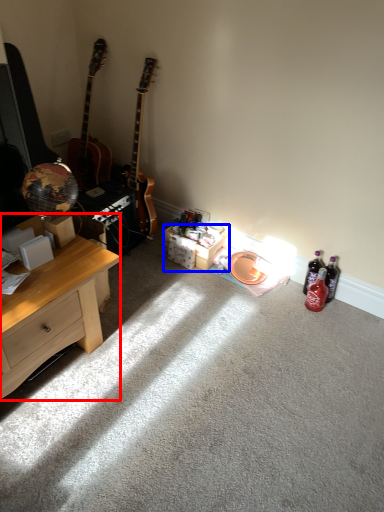
Question: Among these objects, which one is farthest to the camera, desk (highlighted by a red box) or box (highlighted by a blue box)?

Choices:
 (A) desk
 (B) box

Answer: (B)